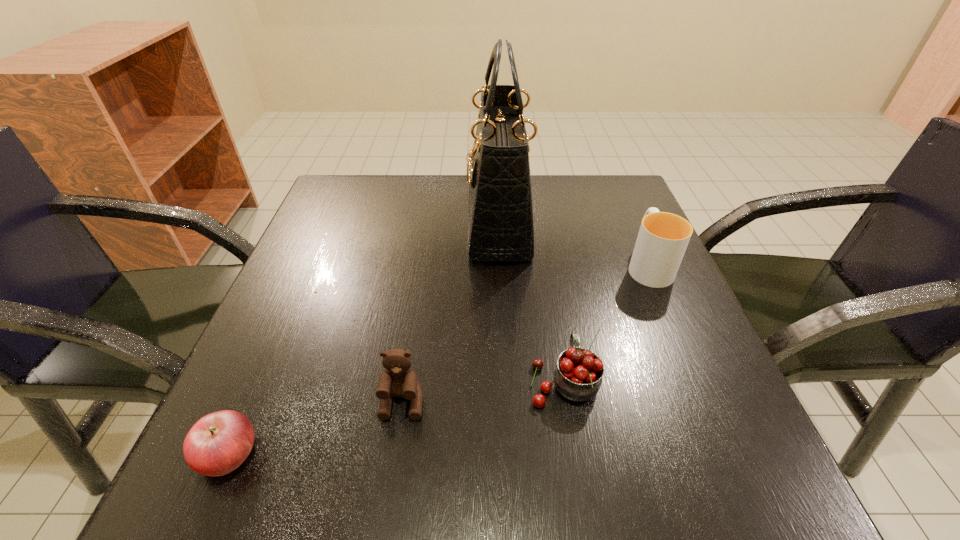
Where is `vacant space located 0.290m with the handle on the side of the rightmost object`? The height and width of the screenshot is (540, 960). vacant space located 0.290m with the handle on the side of the rightmost object is located at coordinates (610, 176).

This screenshot has width=960, height=540. What are the coordinates of `free space located 0.280m with the handle on the side of the rightmost object` in the screenshot? It's located at (611, 178).

Find the location of a particular element. This screenshot has width=960, height=540. vacant space situated on the handle side of the cherry is located at coordinates (547, 283).

Locate an element on the screen. The height and width of the screenshot is (540, 960). vacant point located on the handle side of the cherry is located at coordinates (536, 215).

You are a GUI agent. You are given a task and a screenshot of the screen. Output one action in this format:
    pyautogui.click(x=<x>, y=<y>)
    Task: Click on the blank area located on the handle side of the cherry
    
    Given the screenshot: What is the action you would take?
    click(539, 233)

You are a GUI agent. You are given a task and a screenshot of the screen. Output one action in this format:
    pyautogui.click(x=<x>, y=<y>)
    Task: Click on the vacant space located on the face of the second object from left to right
    
    Given the screenshot: What is the action you would take?
    pyautogui.click(x=389, y=494)

Identify the location of vacant space located 0.100m on the back of the apple. This screenshot has height=540, width=960. (x=266, y=368).

Identify the location of object at the far edge. The width and height of the screenshot is (960, 540). (500, 213).

Where is `object present at the near edge`? This screenshot has height=540, width=960. object present at the near edge is located at coordinates (218, 443).

The height and width of the screenshot is (540, 960). I want to click on object that is positioned at the left edge, so click(x=218, y=443).